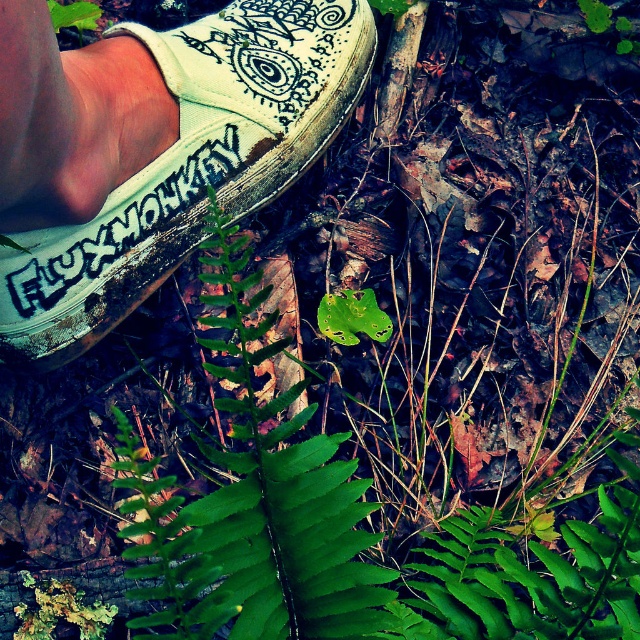
You are an artist trying to sketch the scene. You need to decide which object to draw first based on their size. Which object should you start with, the white canvas shoe at center or the black painted text at lower left?

The white canvas shoe at center is taller than the black painted text at lower left, so you should start by drawing the white canvas shoe at center first since it is larger.

You are a photographer trying to capture the green leafy fern at center in the background. However, the white canvas shoe at center is blocking your view. Can you move the shoe to the side to get a clear shot of the fern?

The white canvas shoe at center is in front of the green leafy fern at center, so moving the shoe to the side would allow you to see the fern clearly.